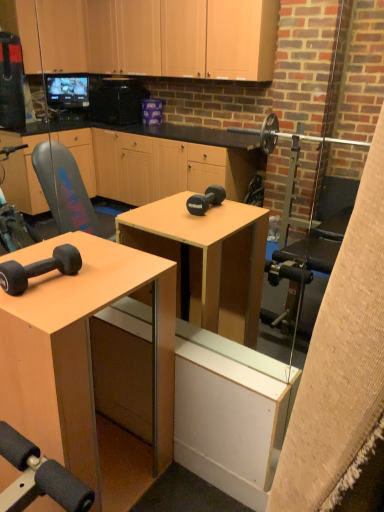
Measure the distance between point (57, 283) and camera.

The distance of point (57, 283) from camera is 4.09 feet.

Locate an element on the screen. This screenshot has height=512, width=384. matte wood desk at center is located at coordinates (84, 362).

Describe the element at coordinates (84, 362) in the screenshot. This screenshot has height=512, width=384. I see `matte wood desk at center` at that location.

You are a GUI agent. You are given a task and a screenshot of the screen. Output one action in this format:
    pyautogui.click(x=<x>, y=<y>)
    Task: Click on the matte black dumbbell at lower left
    
    Given the screenshot: What is the action you would take?
    pyautogui.click(x=39, y=269)

The height and width of the screenshot is (512, 384). What do you see at coordinates (39, 269) in the screenshot? I see `matte black dumbbell at lower left` at bounding box center [39, 269].

What is the approximate height of matte black dumbbell at lower left?

matte black dumbbell at lower left is 3.61 inches in height.

Measure the distance between matte black dumbbell at lower left and camera.

The distance of matte black dumbbell at lower left from camera is 3.79 feet.

The width and height of the screenshot is (384, 512). Find the location of `matte wood desk at center`. matte wood desk at center is located at coordinates (84, 362).

Considering the positions of objects matte black dumbbell at lower left and matte wood desk at center in the image provided, who is more to the right, matte black dumbbell at lower left or matte wood desk at center?

matte black dumbbell at lower left.

Does matte black dumbbell at lower left lie in front of matte wood desk at center?

No, matte black dumbbell at lower left is further to the viewer.

Is point (63, 257) positioned in front of point (60, 281)?

No, (63, 257) is further to viewer.

From the image's perspective, is matte black dumbbell at lower left on top of matte wood desk at center?

Yes, from the image's perspective, matte black dumbbell at lower left is above matte wood desk at center.

From a real-world perspective, is matte black dumbbell at lower left positioned above or below matte wood desk at center?

In terms of real-world spatial position, matte black dumbbell at lower left is above matte wood desk at center.

Which of these two, matte black dumbbell at lower left or matte wood desk at center, is wider?

Wider between the two is matte wood desk at center.

Looking at this image, considering the relative sizes of matte black dumbbell at lower left and matte wood desk at center in the image provided, is matte black dumbbell at lower left shorter than matte wood desk at center?

Yes.

Considering the relative sizes of matte black dumbbell at lower left and matte wood desk at center in the image provided, is matte black dumbbell at lower left smaller than matte wood desk at center?

Indeed, matte black dumbbell at lower left has a smaller size compared to matte wood desk at center.

Is matte wood desk at center a part of matte black dumbbell at lower left?

No, matte black dumbbell at lower left does not contain matte wood desk at center.

Is matte black dumbbell at lower left far from matte wood desk at center?

No.

Is matte black dumbbell at lower left looking in the opposite direction of matte wood desk at center?

matte black dumbbell at lower left does not have its back to matte wood desk at center.

Can you tell me how much matte black dumbbell at lower left and matte wood desk at center differ in facing direction?

1.64 degrees.

At what (x,y) coordinates should I click in order to perform the action: click on desk in front of the matte black dumbbell at lower left. Please return your answer as a coordinate pair (x, y). Image resolution: width=384 pixels, height=512 pixels. Looking at the image, I should click on (84, 362).

Considering the relative positions of matte wood desk at center and matte black dumbbell at lower left in the image provided, is matte wood desk at center to the right of matte black dumbbell at lower left from the viewer's perspective?

No.

From the picture: Considering the positions of objects matte wood desk at center and matte black dumbbell at lower left in the image provided, who is in front, matte wood desk at center or matte black dumbbell at lower left?

matte wood desk at center is more forward.

Is point (52, 389) less distant than point (8, 276)?

Yes, point (52, 389) is closer to viewer.

Looking at this image, from the image's perspective, is matte wood desk at center over matte black dumbbell at lower left?

No.

From a real-world perspective, which is physically above, matte wood desk at center or matte black dumbbell at lower left?

From a 3D spatial view, matte black dumbbell at lower left is above.

Can you confirm if matte wood desk at center is thinner than matte black dumbbell at lower left?

In fact, matte wood desk at center might be wider than matte black dumbbell at lower left.

Does matte wood desk at center have a lesser height compared to matte black dumbbell at lower left?

No, matte wood desk at center is not shorter than matte black dumbbell at lower left.

In terms of size, does matte wood desk at center appear bigger or smaller than matte black dumbbell at lower left?

Clearly, matte wood desk at center is larger in size than matte black dumbbell at lower left.

Is matte wood desk at center inside the boundaries of matte black dumbbell at lower left, or outside?

The correct answer is: outside.

Are matte wood desk at center and matte black dumbbell at lower left beside each other?

No, matte wood desk at center is not beside matte black dumbbell at lower left.

Is matte wood desk at center oriented towards matte black dumbbell at lower left?

No, matte wood desk at center is not facing towards matte black dumbbell at lower left.

What's the angular difference between matte wood desk at center and matte black dumbbell at lower left's facing directions?

1.64 degrees separate the facing orientations of matte wood desk at center and matte black dumbbell at lower left.

The image size is (384, 512). Find the location of `dumbbell that is above the matte wood desk at center (from a real-world perspective)`. dumbbell that is above the matte wood desk at center (from a real-world perspective) is located at coordinates (39, 269).

Where is `dumbbell above the matte wood desk at center (from the image's perspective)`? dumbbell above the matte wood desk at center (from the image's perspective) is located at coordinates (39, 269).

In the image, there is a matte black dumbbell at lower left. In order to click on desk below it (from the image's perspective) in this screenshot , I will do `click(84, 362)`.